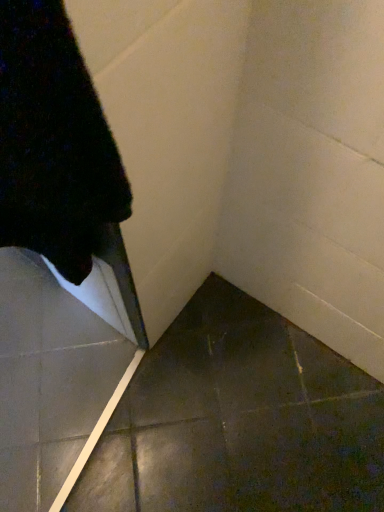
From the picture: In order to face dark gray tile at lower left, should I rotate leftwards or rightwards?

Rotate left and turn 6.360 degrees.

Where is `dark gray tile at lower left`? dark gray tile at lower left is located at coordinates (239, 421).

What do you see at coordinates (239, 421) in the screenshot? This screenshot has height=512, width=384. I see `dark gray tile at lower left` at bounding box center [239, 421].

Measure the distance between dark gray tile at lower left and camera.

The distance of dark gray tile at lower left from camera is 35.30 inches.

You are a GUI agent. You are given a task and a screenshot of the screen. Output one action in this format:
    pyautogui.click(x=<x>, y=<y>)
    Task: Click on the dark gray tile at lower left
    
    Given the screenshot: What is the action you would take?
    pyautogui.click(x=239, y=421)